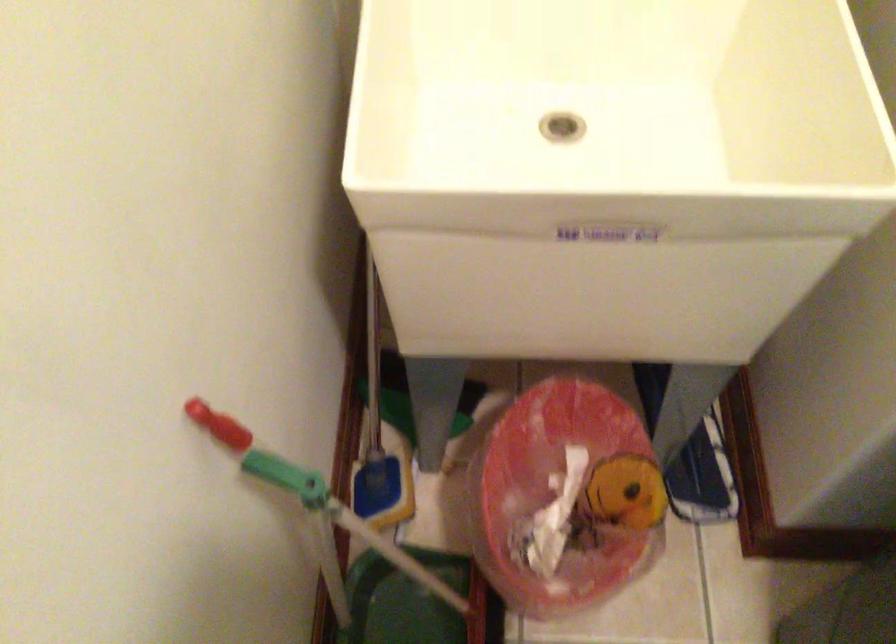
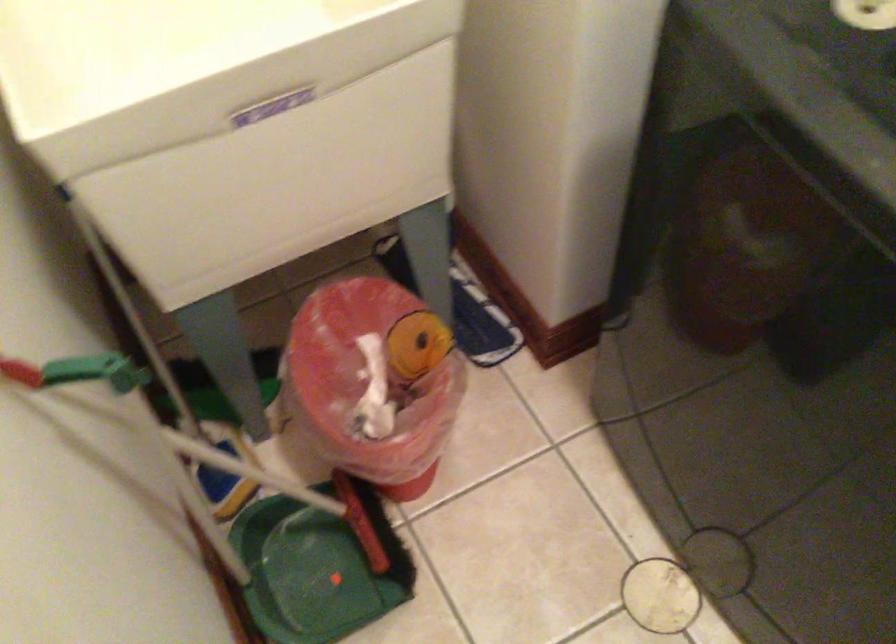
Question: I am providing you with two images of the same scene from different viewpoints. Which of the following objects are not visible in image2?

Choices:
 (A) white broom handle
 (B) brown covered book
 (C) green dustpan handle
 (D) blue dustpan handle

Answer: (D)